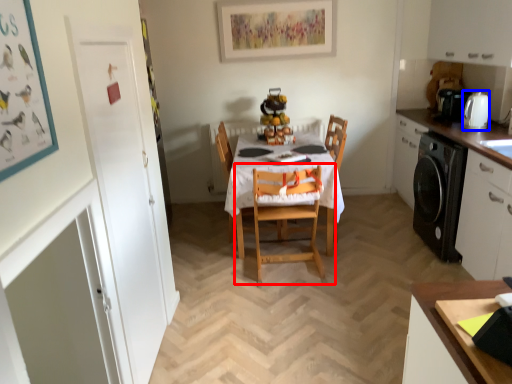
Question: Which point is further to the camera, chair (highlighted by a red box) or appliance (highlighted by a blue box)?

Choices:
 (A) chair
 (B) appliance

Answer: (B)